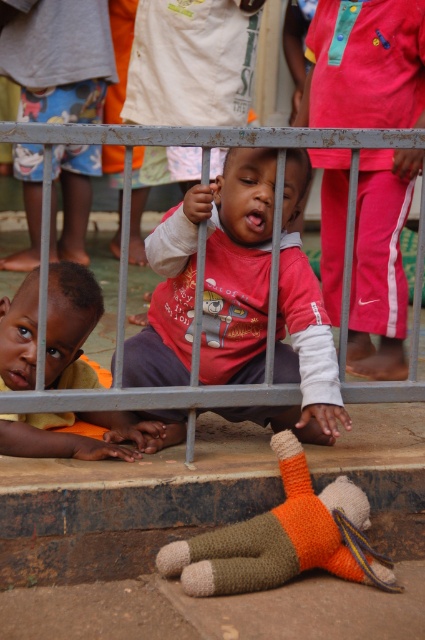
Question: Which is nearer to the knitted orange doll at lower center?

Choices:
 (A) orange fabric shirt at lower left
 (B) matte red shirt at center

Answer: (B)

Question: Is matte red shirt at center positioned behind knitted orange doll at lower center?

Choices:
 (A) yes
 (B) no

Answer: (A)

Question: Based on their relative distances, which object is farther from the orange fabric shirt at lower left?

Choices:
 (A) knitted orange doll at lower center
 (B) matte red shirt at center

Answer: (A)

Question: Is matte red shirt at center to the right of orange fabric shirt at lower left from the viewer's perspective?

Choices:
 (A) no
 (B) yes

Answer: (B)

Question: Which object is the farthest from the knitted orange doll at lower center?

Choices:
 (A) orange fabric shirt at lower left
 (B) matte red shirt at center

Answer: (A)

Question: Does matte red shirt at center come in front of orange fabric shirt at lower left?

Choices:
 (A) yes
 (B) no

Answer: (A)